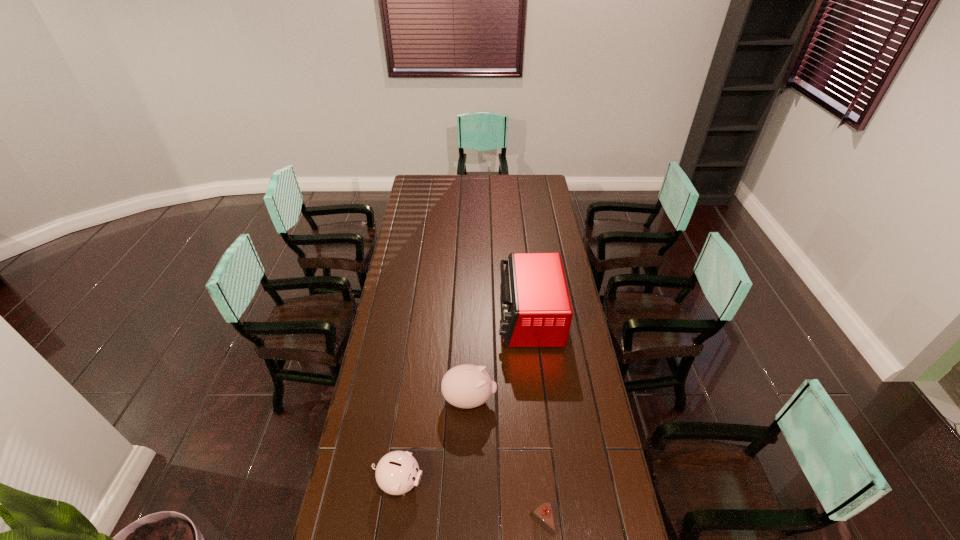
Locate an element on the screen. the farthest object is located at coordinates (536, 308).

Locate an element on the screen. the tallest object is located at coordinates (536, 308).

Locate an element on the screen. This screenshot has width=960, height=540. the second farthest object is located at coordinates (466, 386).

At what (x,y) coordinates should I click in order to perform the action: click on the taller piggy bank. Please return your answer as a coordinate pair (x, y). The image size is (960, 540). Looking at the image, I should click on (466, 386).

This screenshot has height=540, width=960. I want to click on the shorter piggy bank, so click(x=397, y=472).

Find the location of a particular element. the left piggy bank is located at coordinates point(397,472).

The width and height of the screenshot is (960, 540). Identify the location of the nearest object. tap(543, 514).

Locate an element on the screen. Image resolution: width=960 pixels, height=540 pixels. chocolate cake is located at coordinates (543, 514).

You are a GUI agent. You are given a task and a screenshot of the screen. Output one action in this format:
    pyautogui.click(x=<x>, y=<y>)
    Task: Click on the blank space located on the front-facing side of the toaster oven
    This screenshot has width=960, height=540.
    Given the screenshot: What is the action you would take?
    click(457, 318)

You are a GUI agent. You are given a task and a screenshot of the screen. Output one action in this format:
    pyautogui.click(x=<x>, y=<y>)
    Task: Click on the blank area located 0.310m on the front-facing side of the toaster oven
    
    Given the screenshot: What is the action you would take?
    pyautogui.click(x=427, y=318)